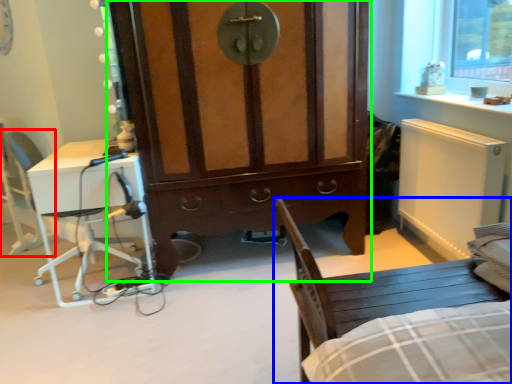
Question: Which object is positioned farthest from armchair (highlighted by a red box)? Select from chair (highlighted by a blue box) and cabinetry (highlighted by a green box).

Choices:
 (A) chair
 (B) cabinetry

Answer: (A)